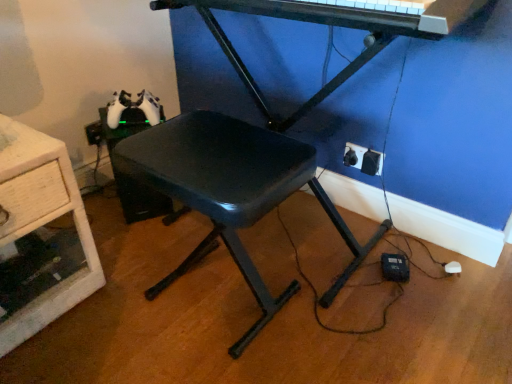
Question: Choose the correct answer: Is black plastic stool at center inside black plastic electric outlet at lower right, which ranks as the 2th electric outlet in front-to-back order, or outside it?

Choices:
 (A) outside
 (B) inside

Answer: (A)

Question: From a real-world perspective, is black plastic stool at center above or below black plastic electric outlet at lower right, which ranks as the 2th electric outlet in front-to-back order?

Choices:
 (A) below
 (B) above

Answer: (B)

Question: Which of these objects is positioned closest to the metallic black piano at upper center?

Choices:
 (A) wooden drawer at left
 (B) black plastic stool at center
 (C) black plastic electric outlet at lower right, which appears as the 2th electric outlet when viewed from the back
 (D) black plastic electric outlet at lower right, which is the 1th electric outlet from back to front

Answer: (B)

Question: Which object is positioned closest to the metallic black piano at upper center?

Choices:
 (A) black plastic stool at center
 (B) black plastic electric outlet at lower right, which is the 1th electric outlet from back to front
 (C) black plastic electric outlet at lower right, which is the 1th electric outlet from front to back
 (D) wooden drawer at left

Answer: (A)